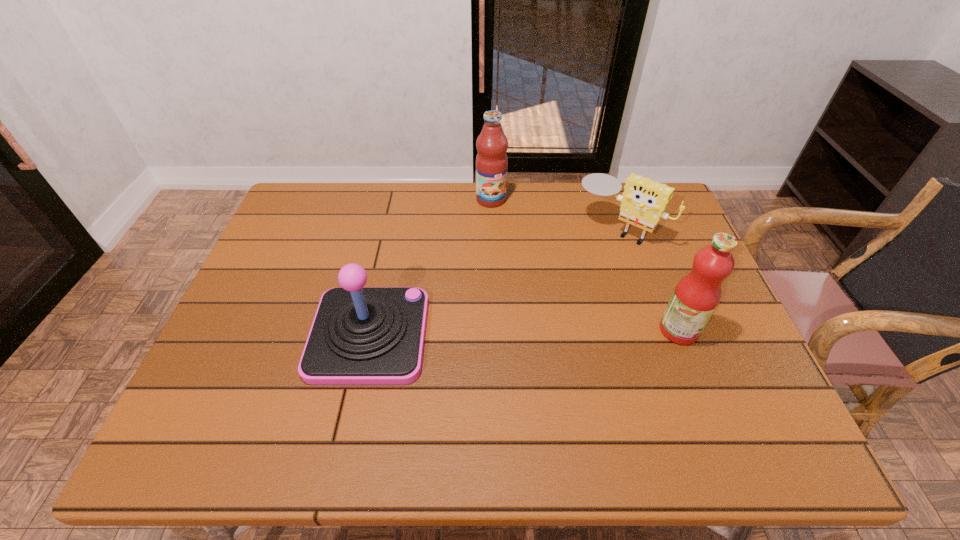
Identify the location of blank space at the far edge of the desktop. The image size is (960, 540). (463, 184).

I want to click on vacant region at the near edge of the desktop, so click(x=596, y=375).

This screenshot has width=960, height=540. I want to click on vacant space at the left edge of the desktop, so 231,338.

Identify the location of vacant space at the right edge. The image size is (960, 540). (680, 270).

Where is `free space at the far left corner`? free space at the far left corner is located at coordinates (332, 210).

In the image, there is a desktop. Identify the location of vacant space at the near left corner. [222, 399].

At what (x,y) coordinates should I click in order to perform the action: click on empty space between the second object from left to right and the nearer fruit juice. Please return your answer as a coordinate pair (x, y). This screenshot has height=540, width=960. Looking at the image, I should click on (585, 265).

This screenshot has width=960, height=540. I want to click on vacant space that is in between the right fruit juice and the left fruit juice, so click(585, 265).

Image resolution: width=960 pixels, height=540 pixels. I want to click on free space between the sponge and the second shortest object, so click(493, 282).

The width and height of the screenshot is (960, 540). Identify the location of free spot between the right fruit juice and the third object from right to left. pyautogui.click(x=585, y=265).